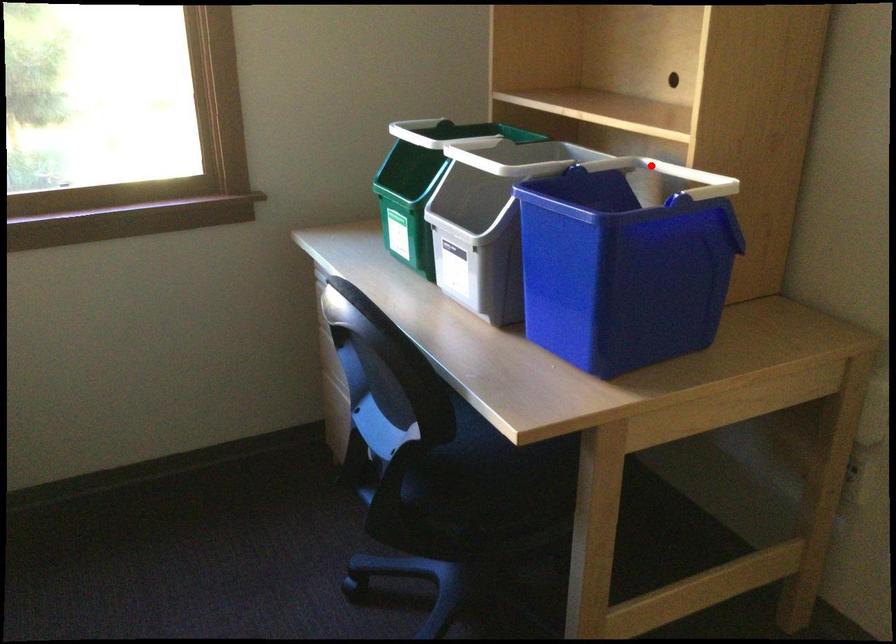
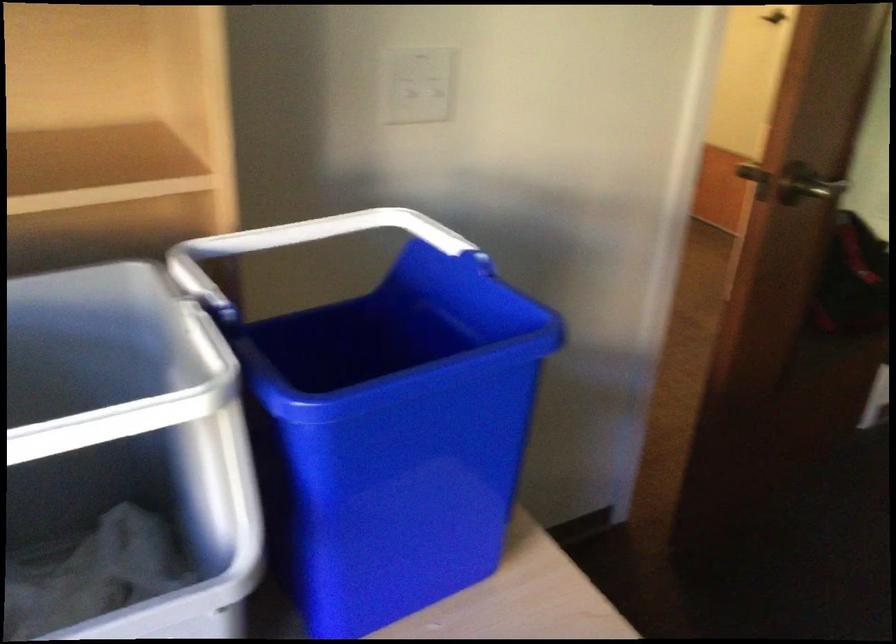
Question: A red point is marked in image1. In image2, is the corresponding 3D point closer to the camera or farther? Reply with the corresponding letter.

Choices:
 (A) The corresponding 3D point is closer.
 (B) The corresponding 3D point is farther.

Answer: (A)